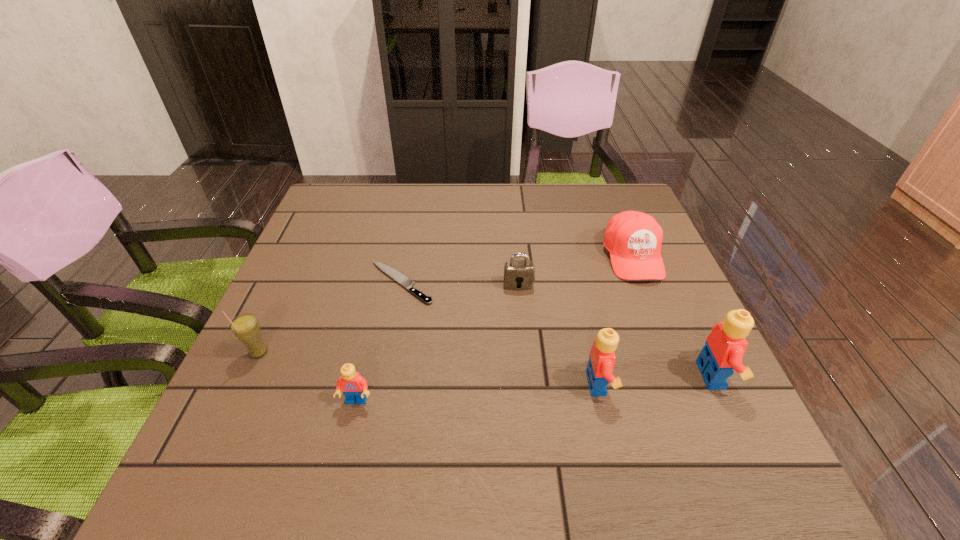
Where is `the shortest Lego`? Image resolution: width=960 pixels, height=540 pixels. the shortest Lego is located at coordinates (354, 387).

I want to click on the second tallest Lego, so click(x=599, y=371).

Identify the location of the fifth object from left to right. (599, 371).

This screenshot has height=540, width=960. Identify the location of the rightmost Lego. (725, 346).

Locate an element on the screen. This screenshot has height=540, width=960. baseball cap is located at coordinates (633, 239).

You are a GUI agent. You are given a task and a screenshot of the screen. Output one action in this format:
    pyautogui.click(x=<x>, y=<y>)
    Task: Click on the straw for drinking
    
    Given the screenshot: What is the action you would take?
    pyautogui.click(x=246, y=328)

Identify the location of steak knife. (393, 273).

Locate an element on the screen. padlock is located at coordinates (515, 271).

You are a GUI agent. You are given a task and a screenshot of the screen. Output one action in this format:
    pyautogui.click(x=<x>, y=<y>)
    Task: Click on the blank area located 0.090m on the face of the second Lego from left to right
    The width and height of the screenshot is (960, 540).
    Given the screenshot: What is the action you would take?
    pyautogui.click(x=659, y=383)

At what (x,y) coordinates should I click in order to perform the action: click on free space located 0.250m on the front panel of the baseball cap. Please return your answer as a coordinate pair (x, y). The image size is (960, 540). Looking at the image, I should click on (679, 372).